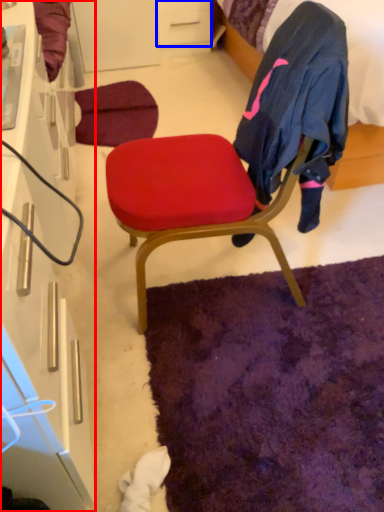
Question: Among these objects, which one is farthest to the camera, cabinetry (highlighted by a red box) or drawer (highlighted by a blue box)?

Choices:
 (A) cabinetry
 (B) drawer

Answer: (B)